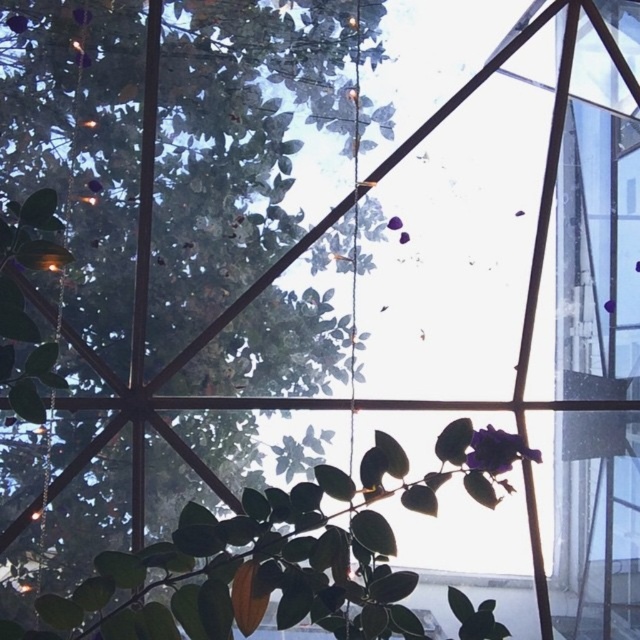
You are an interior designer assessing the lighting in the room. You notice the transparent glass window at right and the purple matte flower at lower right. Which object is positioned higher in the scene?

The transparent glass window at right is above the purple matte flower at lower right, so it is positioned higher in the scene.

You are an interior designer assessing the placement of the green matte leafy plant at lower center and the transparent glass window at right. Based on their sizes, which object would you consider adjusting to ensure proper lighting for the plant?

The green matte leafy plant at lower center is not as tall as the transparent glass window at right, so adjusting the plant closer to the window might help it receive adequate light.

You are standing in front of the glass structure and want to water the plants. Which plant, the green leafy tree at center or the green matte leafy plant at lower center, is closer to you?

The green matte leafy plant at lower center is behind the green leafy tree at center, so the green leafy tree at center is closer to you.